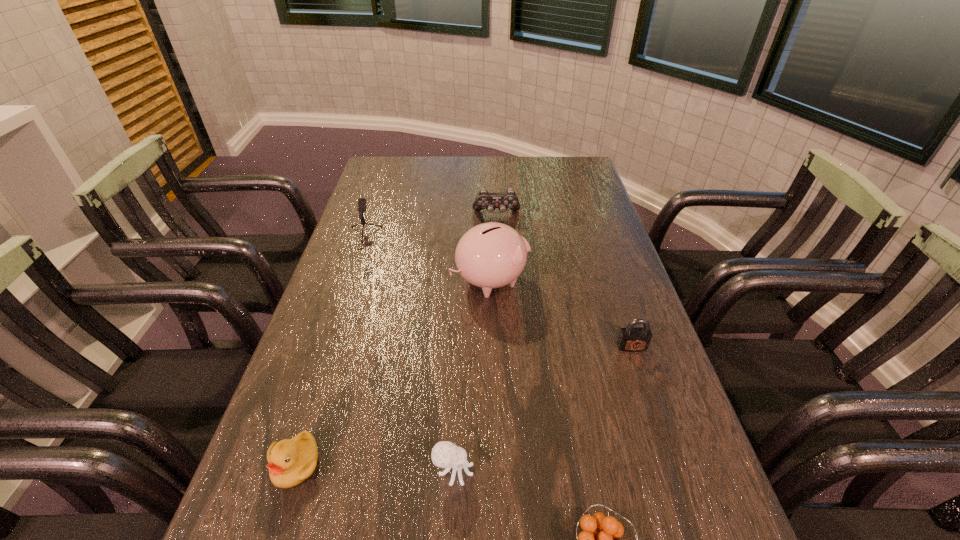
This screenshot has height=540, width=960. I want to click on object that is the sixth closest to the octopus, so click(x=484, y=199).

The image size is (960, 540). In order to click on free region that satisfies the following two spatial constraints: 1. on the front of the padlock near the keyhole; 2. on the front-facing side of the octopus in this screenshot , I will do `click(673, 471)`.

I want to click on blank area in the image that satisfies the following two spatial constraints: 1. on the front of the padlock near the keyhole; 2. on the front-facing side of the octopus, so click(673, 471).